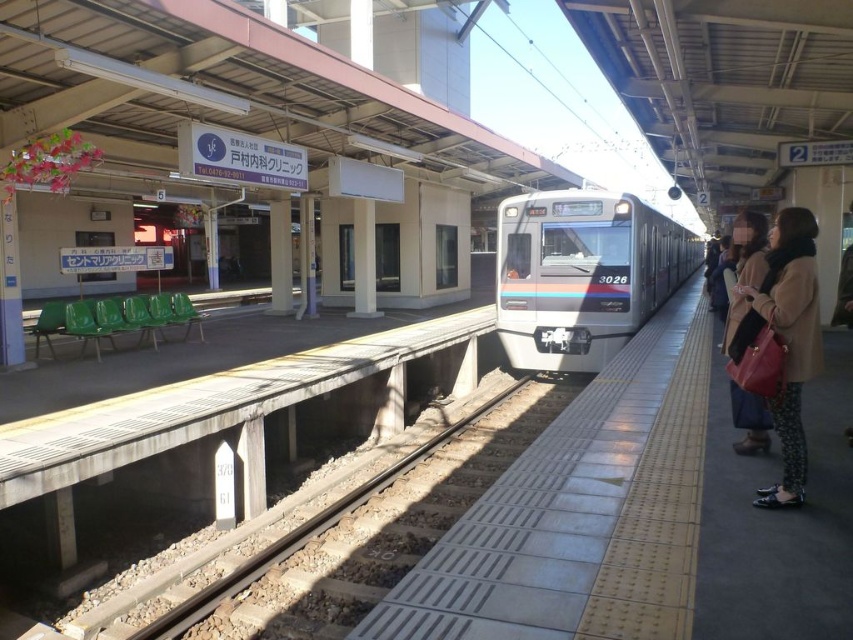
Is sleek metallic train at center to the left of brown leather handbag at right from the viewer's perspective?

Incorrect, sleek metallic train at center is not on the left side of brown leather handbag at right.

Which is in front, point (509, 273) or point (744, 403)?

Point (744, 403) is in front.

Does point (595, 216) lie behind point (726, 330)?

Yes, it is behind point (726, 330).

You are a GUI agent. You are given a task and a screenshot of the screen. Output one action in this format:
    pyautogui.click(x=<x>, y=<y>)
    Task: Click on the sleek metallic train at center
    This screenshot has width=853, height=640.
    Given the screenshot: What is the action you would take?
    pyautogui.click(x=582, y=275)

Does point (787, 212) come closer to viewer compared to point (741, 406)?

Yes, it is in front of point (741, 406).

Can you confirm if beige wool coat at right is positioned above brown leather handbag at right?

No.

The width and height of the screenshot is (853, 640). I want to click on beige wool coat at right, so click(791, 340).

Is sleek metallic train at center wider than beige wool coat at right?

A: Indeed, sleek metallic train at center has a greater width compared to beige wool coat at right.

Which of these two, sleek metallic train at center or beige wool coat at right, stands shorter?

beige wool coat at right

What do you see at coordinates (582, 275) in the screenshot?
I see `sleek metallic train at center` at bounding box center [582, 275].

You are a GUI agent. You are given a task and a screenshot of the screen. Output one action in this format:
    pyautogui.click(x=<x>, y=<y>)
    Task: Click on the sleek metallic train at center
    
    Given the screenshot: What is the action you would take?
    pyautogui.click(x=582, y=275)